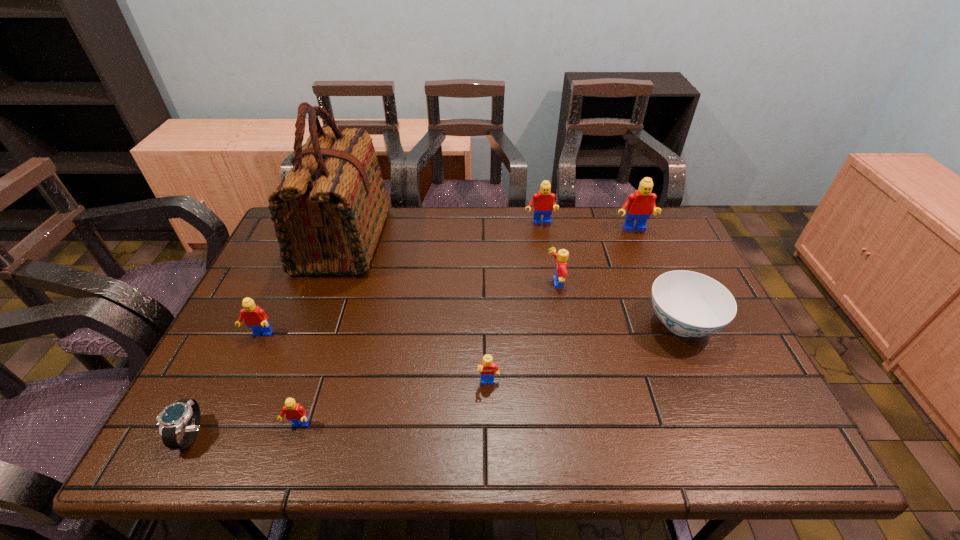
Image resolution: width=960 pixels, height=540 pixels. What are the coordinates of `the tallest object` in the screenshot? It's located at (328, 212).

Locate an element on the screen. The width and height of the screenshot is (960, 540). the rightmost red Lego is located at coordinates (639, 204).

Locate an element on the screen. the biggest red Lego is located at coordinates (639, 204).

The image size is (960, 540). Identify the location of the third smallest red Lego. (544, 202).

You are a GUI agent. You are given a task and a screenshot of the screen. Output one action in this format:
    pyautogui.click(x=<x>, y=<y>)
    Task: Click on the third red Lego from left to right
    
    Given the screenshot: What is the action you would take?
    pyautogui.click(x=544, y=202)

Image resolution: width=960 pixels, height=540 pixels. Find the location of `the right yellow Lego`. the right yellow Lego is located at coordinates (562, 256).

Image resolution: width=960 pixels, height=540 pixels. Find the location of `the bigger yellow Lego`. the bigger yellow Lego is located at coordinates (562, 256).

Identify the location of the third nearest Lego. The height and width of the screenshot is (540, 960). (254, 317).

Image resolution: width=960 pixels, height=540 pixels. Identify the location of the third farthest red Lego. (254, 317).

You are a GUI agent. You are given a task and a screenshot of the screen. Output one action in this format:
    pyautogui.click(x=<x>, y=<y>)
    Task: Click on the blue chinaware
    
    Given the screenshot: What is the action you would take?
    pyautogui.click(x=690, y=304)